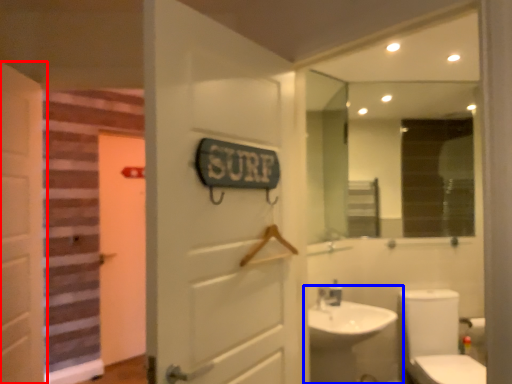
Question: Which of the following is the farthest to the observer, door (highlighted by a red box) or sink (highlighted by a blue box)?

Choices:
 (A) door
 (B) sink

Answer: (B)